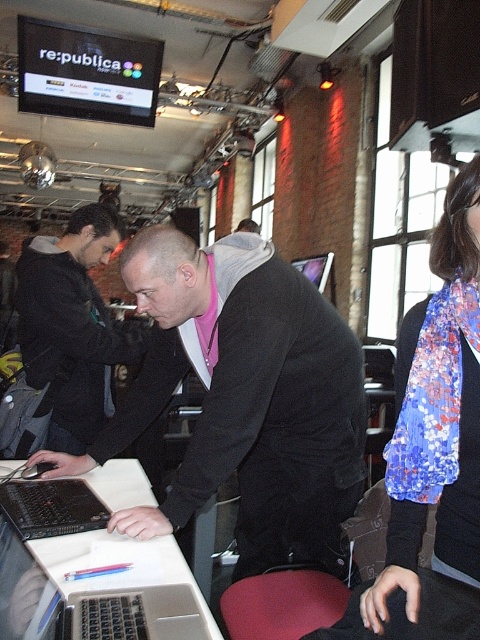
Question: Observing the image, what is the correct spatial positioning of matte black jacket at center in reference to floral silk scarf at upper right?

Choices:
 (A) above
 (B) below

Answer: (B)

Question: Based on their relative distances, which object is farther from the floral silk scarf at upper right?

Choices:
 (A) dark gray hoodie at center
 (B) matte black jacket at center
 (C) white plastic table at center

Answer: (A)

Question: Is white plastic table at center closer to the viewer compared to dark gray hoodie at center?

Choices:
 (A) no
 (B) yes

Answer: (B)

Question: Does floral silk scarf at upper right come behind white plastic table at center?

Choices:
 (A) yes
 (B) no

Answer: (A)

Question: Which object is the closest to the white plastic table at center?

Choices:
 (A) black matte keyboard at center
 (B) floral silk scarf at upper right
 (C) dark gray hoodie at center
 (D) matte black jacket at center

Answer: (A)

Question: Which object is positioned closest to the white plastic table at center?

Choices:
 (A) dark gray hoodie at center
 (B) matte black jacket at center

Answer: (B)